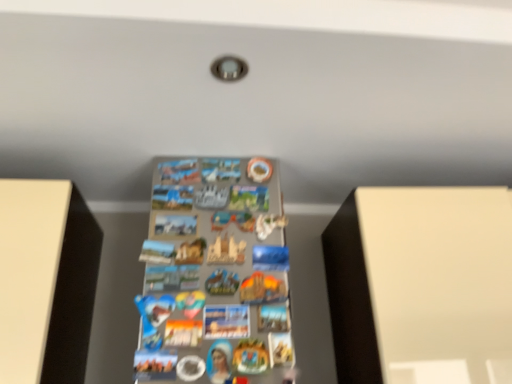
Question: Does white matte cabinet at right appear on the left side of metallic silver magnets at center?

Choices:
 (A) yes
 (B) no

Answer: (B)

Question: Can you confirm if white matte cabinet at right is shorter than metallic silver magnets at center?

Choices:
 (A) yes
 (B) no

Answer: (A)

Question: From the image's perspective, is white matte cabinet at right located beneath metallic silver magnets at center?

Choices:
 (A) no
 (B) yes

Answer: (B)

Question: Does white matte cabinet at right have a larger size compared to metallic silver magnets at center?

Choices:
 (A) no
 (B) yes

Answer: (B)

Question: Is white matte cabinet at right positioned far away from metallic silver magnets at center?

Choices:
 (A) no
 (B) yes

Answer: (A)

Question: Can you confirm if white matte cabinet at right is wider than metallic silver magnets at center?

Choices:
 (A) yes
 (B) no

Answer: (B)

Question: From the image's perspective, is metallic silver magnets at center above white matte cabinet at right?

Choices:
 (A) yes
 (B) no

Answer: (A)

Question: Can we say metallic silver magnets at center lies outside white matte cabinet at right?

Choices:
 (A) no
 (B) yes

Answer: (B)

Question: Is metallic silver magnets at center looking in the opposite direction of white matte cabinet at right?

Choices:
 (A) no
 (B) yes

Answer: (A)

Question: Is metallic silver magnets at center surrounding white matte cabinet at right?

Choices:
 (A) no
 (B) yes

Answer: (A)

Question: Would you say metallic silver magnets at center is a long distance from white matte cabinet at right?

Choices:
 (A) yes
 (B) no

Answer: (B)

Question: Is metallic silver magnets at center closer to camera compared to white matte cabinet at right?

Choices:
 (A) yes
 (B) no

Answer: (A)

Question: Relative to white matte cabinet at right, is metallic silver magnets at center in front or behind?

Choices:
 (A) behind
 (B) front

Answer: (B)